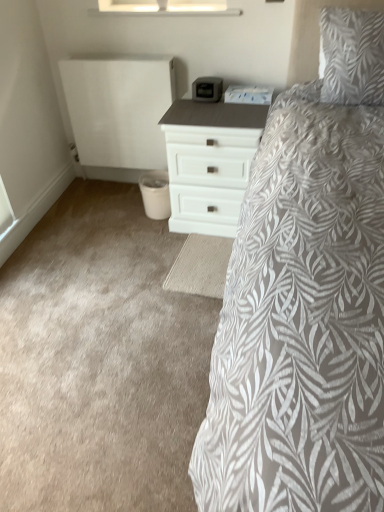
The image size is (384, 512). What are the coordinates of `free space in front of white matte chest of drawers at center` in the screenshot? It's located at (185, 263).